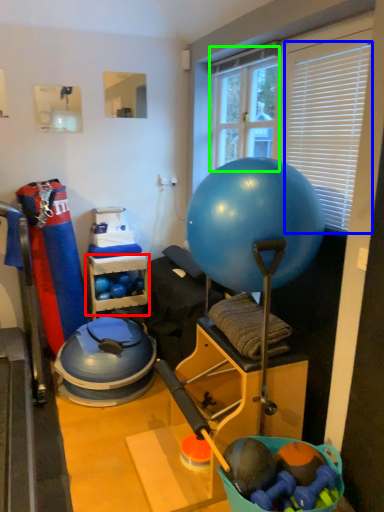
Question: Considering the real-world distances, which object is closest to shelf (highlighted by a red box)? blind (highlighted by a blue box) or window screen (highlighted by a green box).

Choices:
 (A) blind
 (B) window screen

Answer: (B)